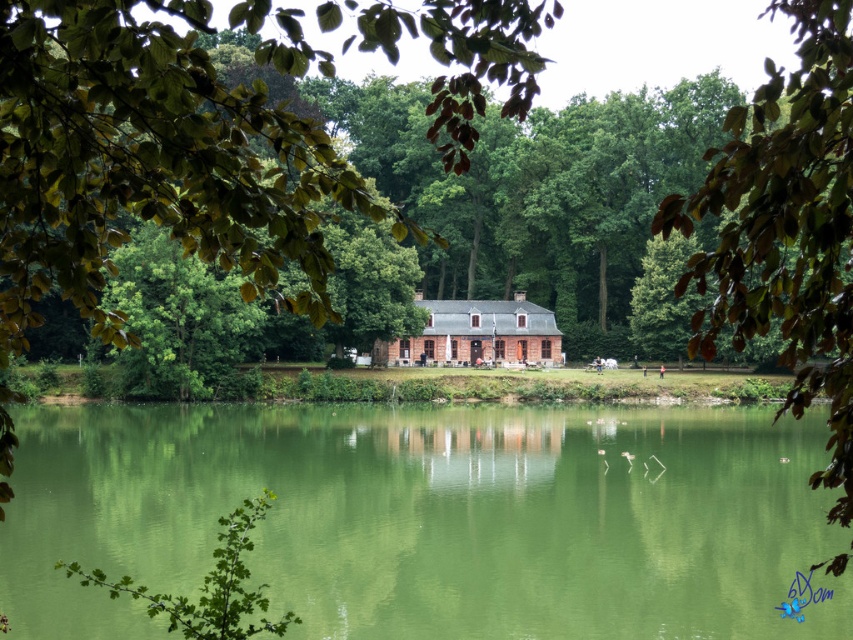
Question: Which object is farther from the camera taking this photo?

Choices:
 (A) green smooth water at center
 (B) brown brick cottage at center

Answer: (B)

Question: Is the position of green smooth water at center less distant than that of brown brick cottage at center?

Choices:
 (A) yes
 (B) no

Answer: (A)

Question: Does green leafy tree at upper right have a larger size compared to brown brick cottage at center?

Choices:
 (A) no
 (B) yes

Answer: (B)

Question: Which object appears closest to the camera in this image?

Choices:
 (A) green leafy tree at upper right
 (B) brown brick cottage at center

Answer: (A)

Question: Which object is farther from the camera taking this photo?

Choices:
 (A) brown brick cottage at center
 (B) green leafy tree at upper right

Answer: (A)

Question: Does green smooth water at center appear on the left side of green leafy tree at upper right?

Choices:
 (A) no
 (B) yes

Answer: (B)